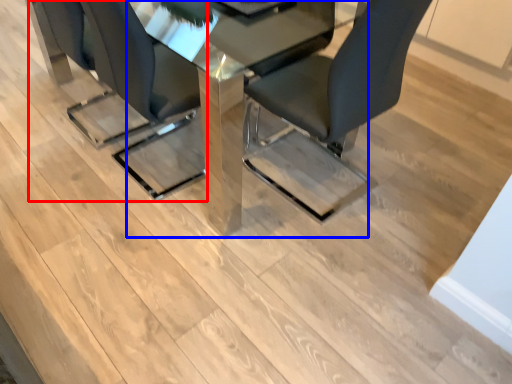
Question: Which point is closer to the camera, chair (highlighted by a red box) or table (highlighted by a blue box)?

Choices:
 (A) chair
 (B) table

Answer: (B)